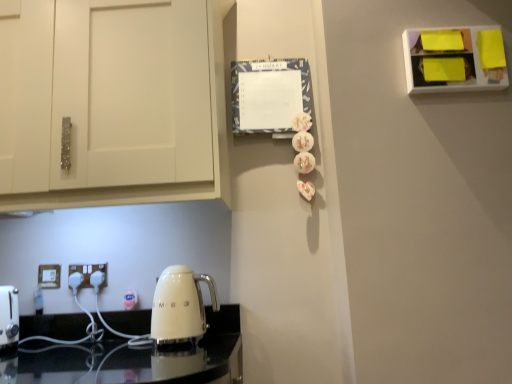
Question: Is white plastic electric outlet at lower left, the 2th electric outlet viewed from the right, wider or thinner than white plastic electric outlet at lower left, placed as the 1th electric outlet when sorted from right to left?

Choices:
 (A) thin
 (B) wide

Answer: (A)

Question: In terms of height, does white plastic electric outlet at lower left, marked as the first electric outlet in a left-to-right arrangement, look taller or shorter compared to white plastic electric outlet at lower left, placed as the 1th electric outlet when sorted from right to left?

Choices:
 (A) short
 (B) tall

Answer: (B)

Question: In the image, is white plastic electric outlet at lower left, the 2th electric outlet viewed from the right, positioned in front of or behind white plastic electric outlet at lower left, the 2th electric outlet in the left-to-right sequence?

Choices:
 (A) behind
 (B) front

Answer: (A)

Question: In terms of height, does white plastic electric outlet at lower left, placed as the 1th electric outlet when sorted from right to left, look taller or shorter compared to white plastic electric outlet at lower left, the 2th electric outlet viewed from the right?

Choices:
 (A) short
 (B) tall

Answer: (A)

Question: From the image's perspective, relative to white plastic electric outlet at lower left, the 2th electric outlet viewed from the right, is white plastic electric outlet at lower left, placed as the 1th electric outlet when sorted from right to left, above or below?

Choices:
 (A) below
 (B) above

Answer: (B)

Question: In the image, is white plastic electric outlet at lower left, the 2th electric outlet in the left-to-right sequence, positioned in front of or behind white plastic electric outlet at lower left, marked as the first electric outlet in a left-to-right arrangement?

Choices:
 (A) behind
 (B) front

Answer: (B)

Question: In terms of size, does white plastic electric outlet at lower left, the 2th electric outlet in the left-to-right sequence, appear bigger or smaller than white plastic electric outlet at lower left, the 2th electric outlet viewed from the right?

Choices:
 (A) big
 (B) small

Answer: (A)